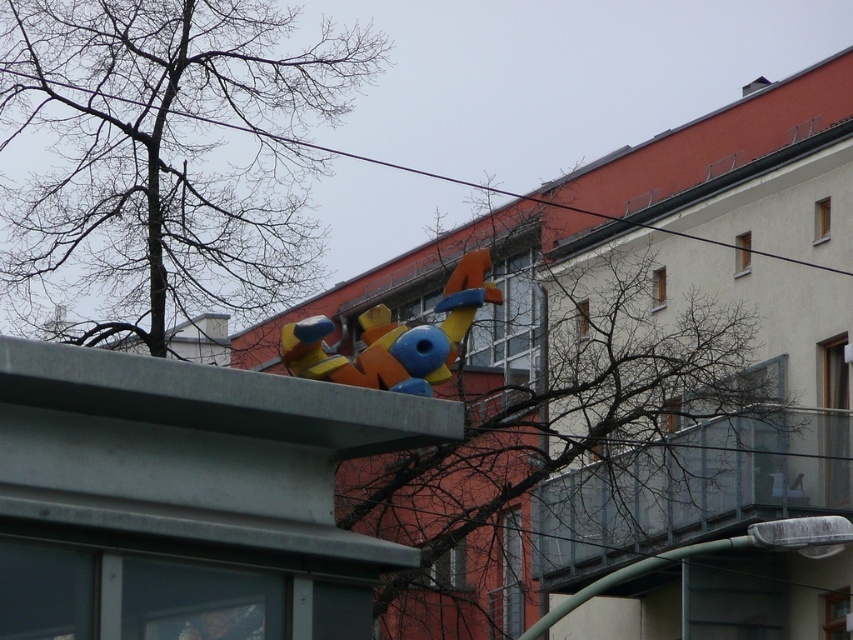
Is bare branches at upper left to the right of bare branches at upper center from the viewer's perspective?

In fact, bare branches at upper left is to the left of bare branches at upper center.

Based on the photo, who is taller, bare branches at upper left or bare branches at upper center?

bare branches at upper center

Is point (187, 310) farther from camera compared to point (715, 538)?

No, it is not.

What are the coordinates of `bare branches at upper left` in the screenshot? It's located at (165, 156).

Does bare branches at upper center have a larger size compared to black wire at upper center?

No.

What are the coordinates of `bare branches at upper center` in the screenshot? It's located at (677, 442).

The width and height of the screenshot is (853, 640). I want to click on bare branches at upper center, so click(677, 442).

Can you confirm if bare branches at upper left is positioned below matte plastic toy at center?

Result: Incorrect, bare branches at upper left is not positioned below matte plastic toy at center.

This screenshot has height=640, width=853. What do you see at coordinates (165, 156) in the screenshot?
I see `bare branches at upper left` at bounding box center [165, 156].

In order to click on bare branches at upper left in this screenshot , I will do `click(165, 156)`.